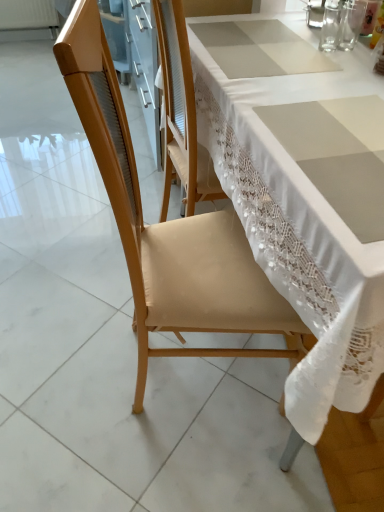
Locate an element on the screen. free space behind transparent glass at upper right, arranged as the 2th tableware when viewed from the right is located at coordinates (314, 25).